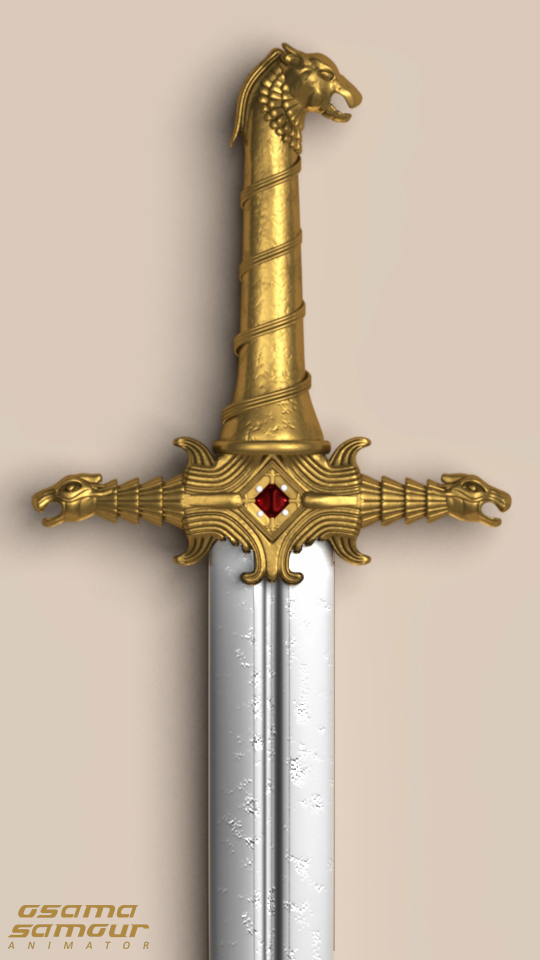
Identify the location of wall. The height and width of the screenshot is (960, 540). (511, 198), (126, 764).